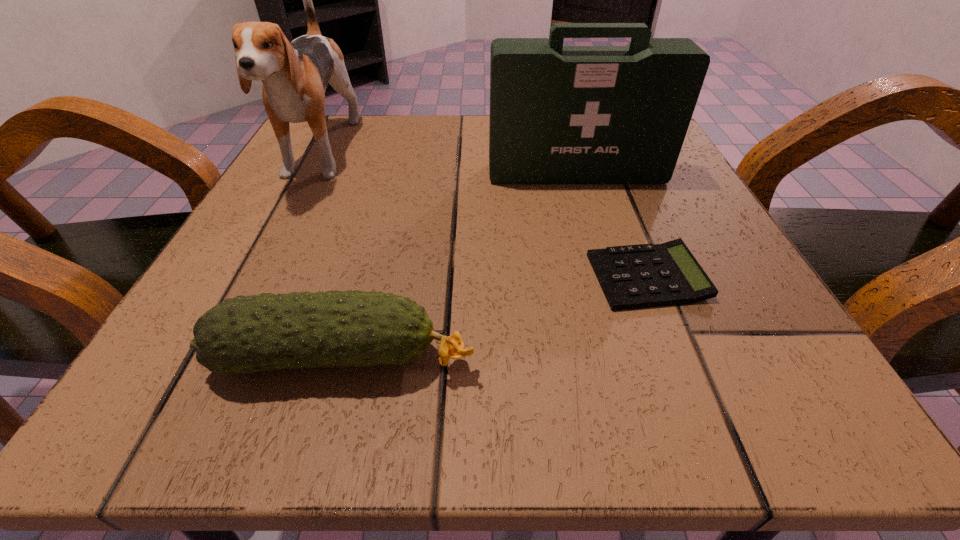
Where is `puppy that is positioned at the far edge`? This screenshot has width=960, height=540. puppy that is positioned at the far edge is located at coordinates (295, 75).

Identify the location of the first-aid kit situated at the far edge. (559, 114).

Identify the location of object located in the near edge section of the desktop. Image resolution: width=960 pixels, height=540 pixels. (245, 334).

At what (x,y) coordinates should I click in order to perform the action: click on puppy that is at the left edge. Please return your answer as a coordinate pair (x, y). Image resolution: width=960 pixels, height=540 pixels. Looking at the image, I should click on (295, 75).

Locate an element on the screen. The height and width of the screenshot is (540, 960). cucumber present at the left edge is located at coordinates (245, 334).

I want to click on the first-aid kit located at the right edge, so click(559, 114).

Where is `calculator that is at the right edge`? This screenshot has height=540, width=960. calculator that is at the right edge is located at coordinates (638, 276).

Find the location of a particular element. Image resolution: width=960 pixels, height=540 pixels. object present at the far left corner is located at coordinates (295, 75).

Find the location of a particular element. The height and width of the screenshot is (540, 960). object situated at the near left corner is located at coordinates (245, 334).

Find the location of a particular element. The width and height of the screenshot is (960, 540). object that is at the far right corner is located at coordinates (559, 114).